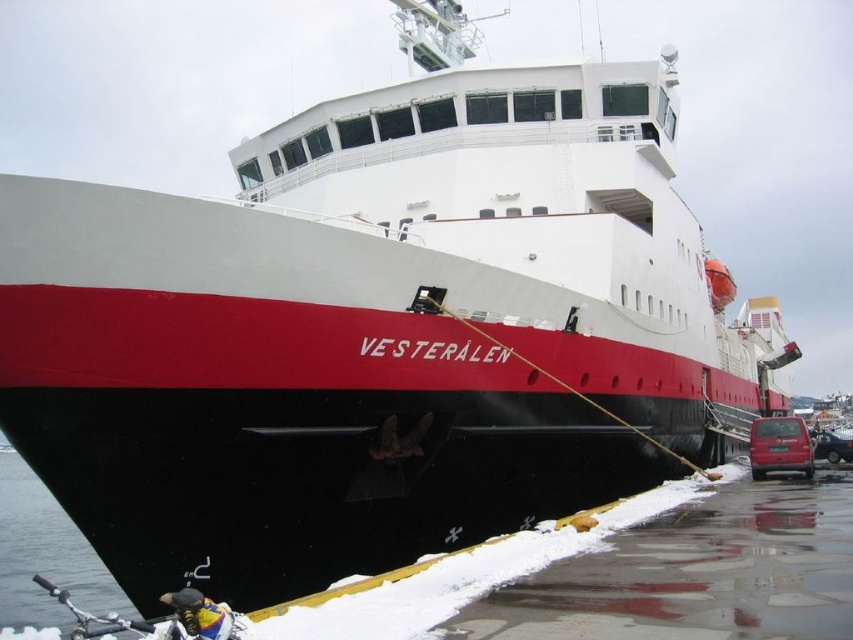
You are a parking attendant at the ferry terminal. You need to park a new vehicle that is 2 meters wide between the matte red van at lower right and the metallic silver car at lower right. Can the new vehicle fit in the space between them?

The matte red van at lower right has a lesser width compared to metallic silver car at lower right. However, the available space between them depends on their positioning and the total distance between the two vehicles, which is not specified in the description. Therefore, it is uncertain if the 2 meter wide vehicle can fit without more information about the spacing between the two vehicles.

You are a passenger on the ferry Vesteralen and want to board your vehicle, which is parked at the lower right of the ferry. You see both the matte red van at lower right and the metallic silver car at lower right. Which vehicle is positioned higher up relative to the other?

The matte red van at lower right is positioned above the metallic silver car at lower right.

You are standing at the center of the ferry Vesteralen and want to find the matte red van at lower right. Which direction should you walk to reach it?

The matte red van at lower right is located at point (x=779, y=445), which is towards the lower right direction from your current position at the center of the ferry Vesteralen. Walk towards the lower right direction to reach it.